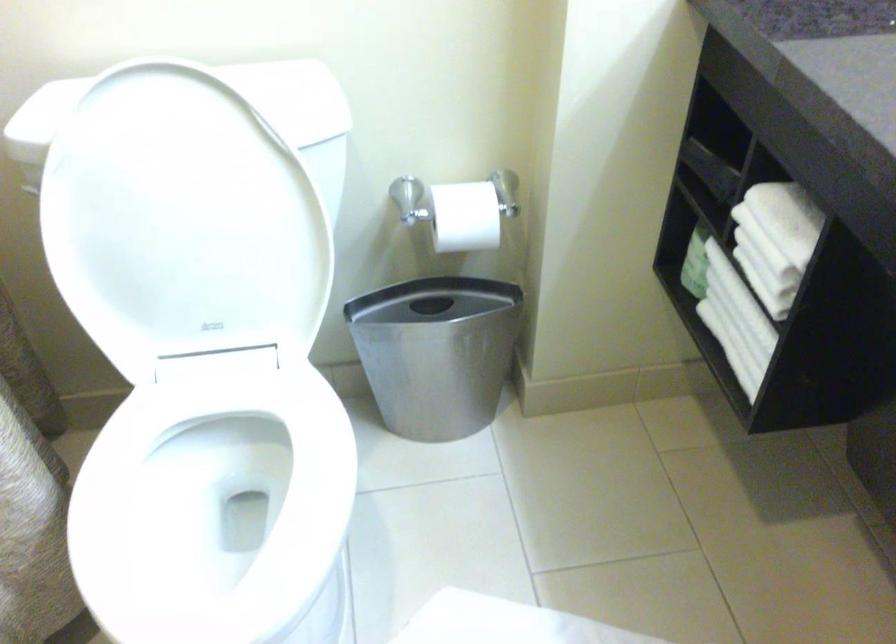
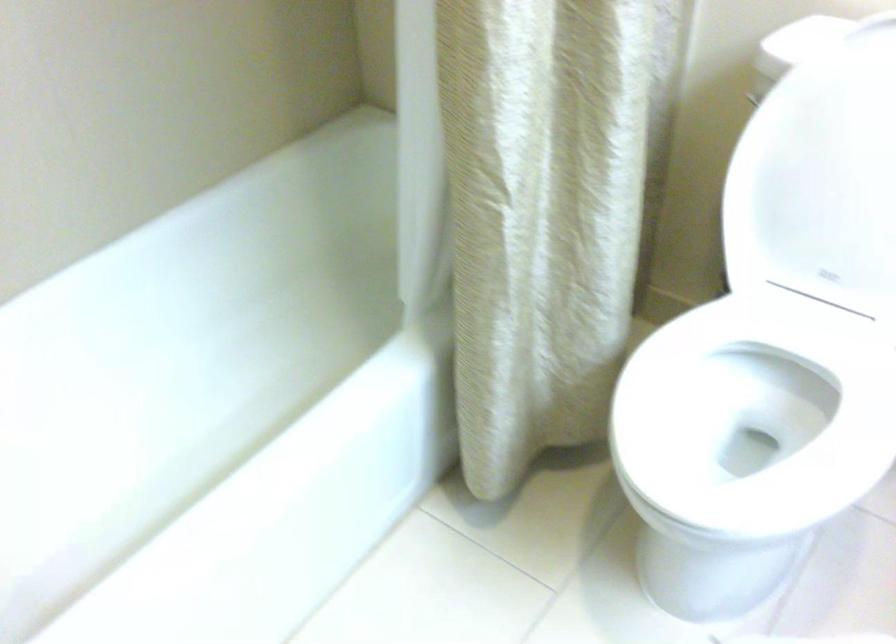
Find the pixel in the second image that matches pixel 159 245 in the first image.

(821, 178)